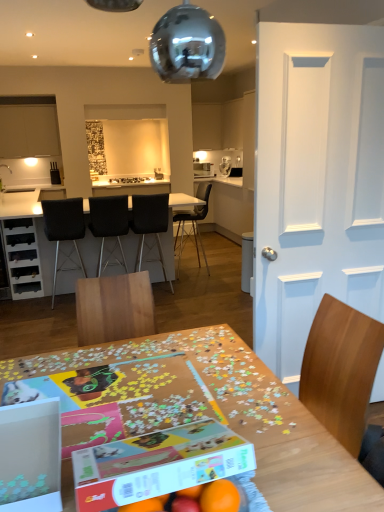
Find the location of a particular element. free spot behind orange matte at lower center is located at coordinates (261, 472).